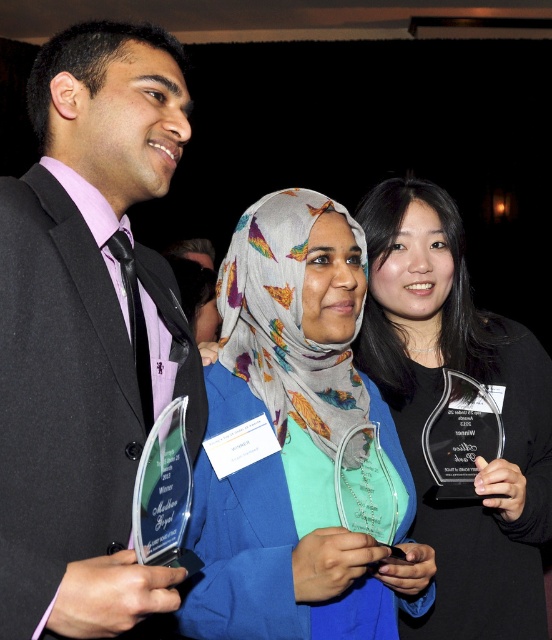
Consider the image. You are organizing a display case for awards and need to know the size relationship between the translucent glass award at center and the clear glass award at center. Which one takes up more space?

The clear glass award at center takes up more space than the translucent glass award at center because the translucent glass award at center occupies less space than clear glass award at center.

You are organizing a photo album and need to place the matte black suit at left and the clear glass award at center into a row. If the row has limited width, which object should be placed first to ensure both fit without overlapping?

The matte black suit at left is thinner than the clear glass award at center, so place the matte black suit at left first to accommodate the wider award next.